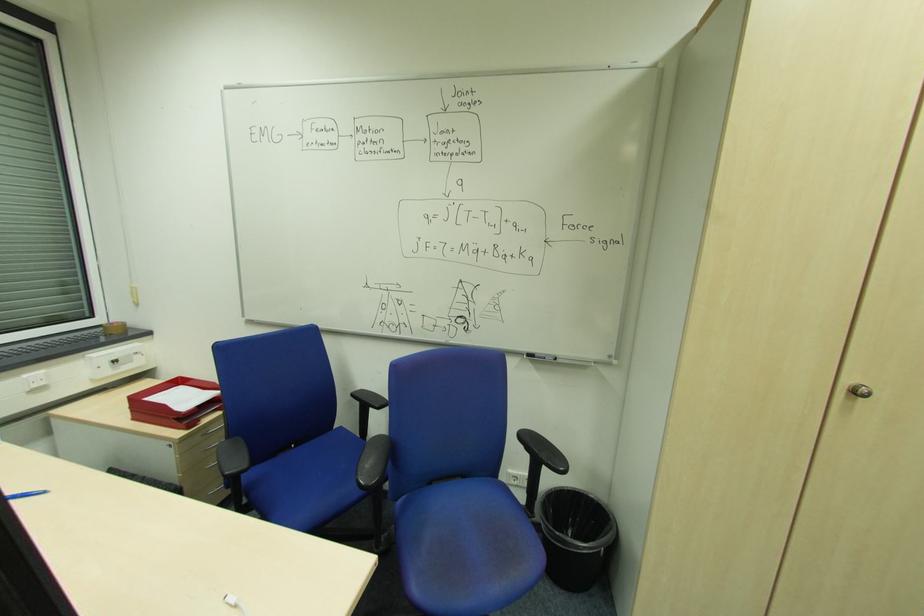
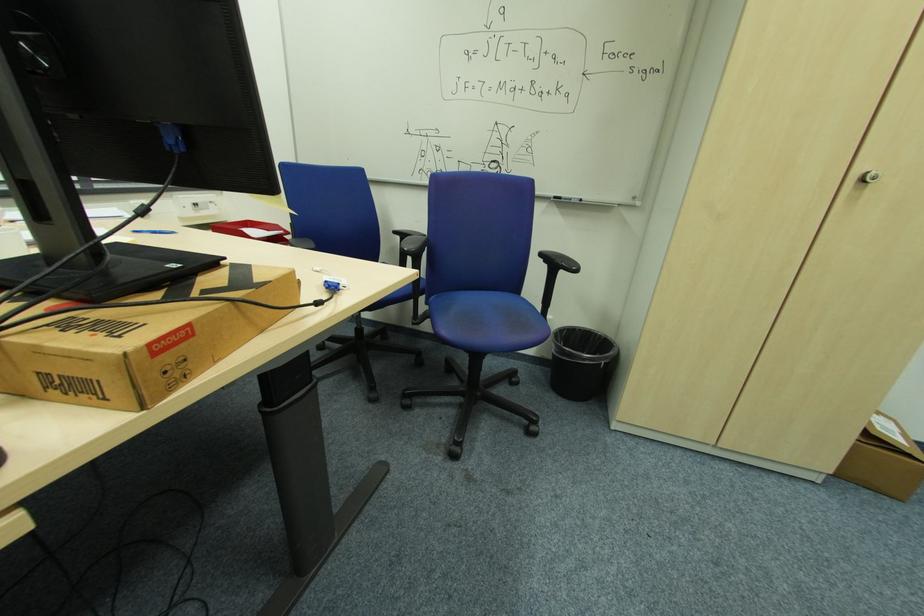
Question: Which direction would the cameraman need to move to produce the second image? Reply with the corresponding letter.

Choices:
 (A) Left
 (B) Right
 (C) Forward
 (D) Backward

Answer: (D)